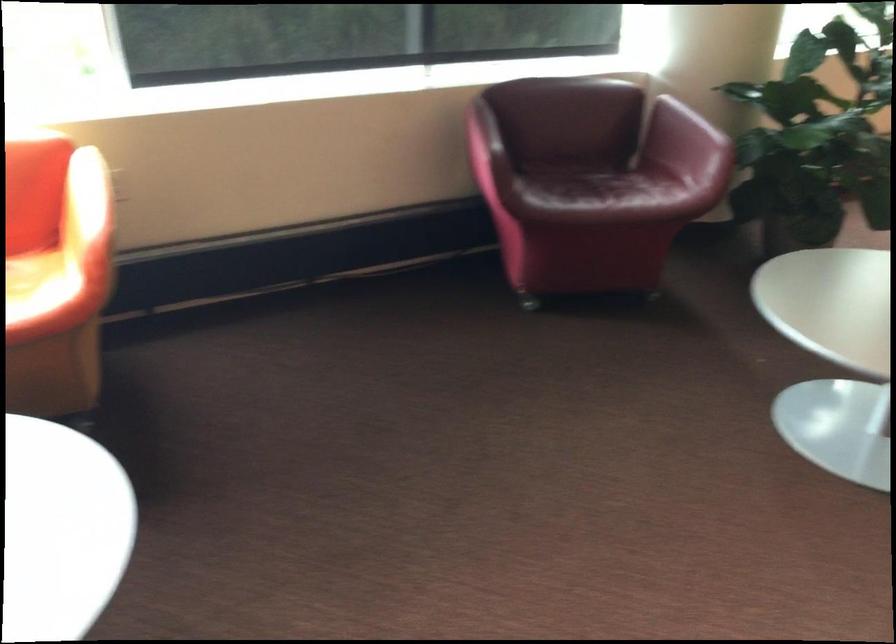
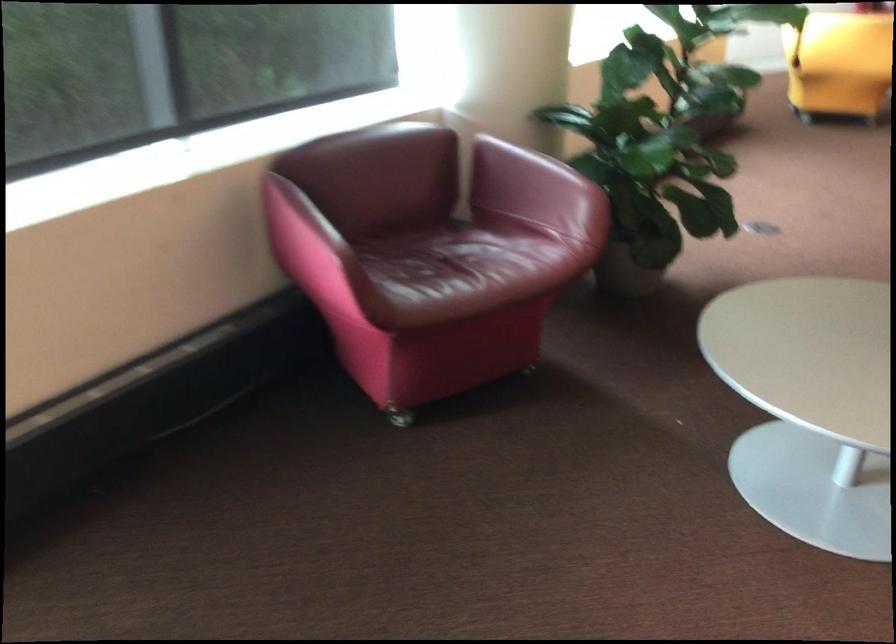
Where in the second image is the point corresponding to the point at 692,122 from the first image?

(543, 169)